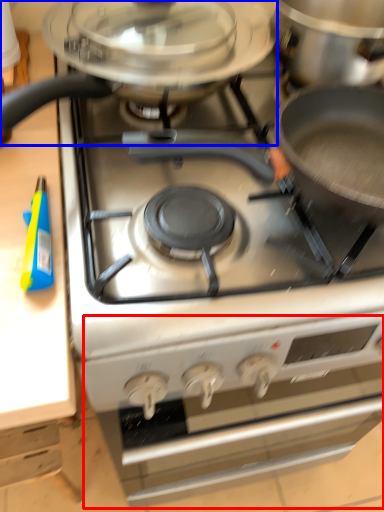
Question: Among these objects, which one is farthest to the camera, oven (highlighted by a red box) or kitchen appliance (highlighted by a blue box)?

Choices:
 (A) oven
 (B) kitchen appliance

Answer: (A)